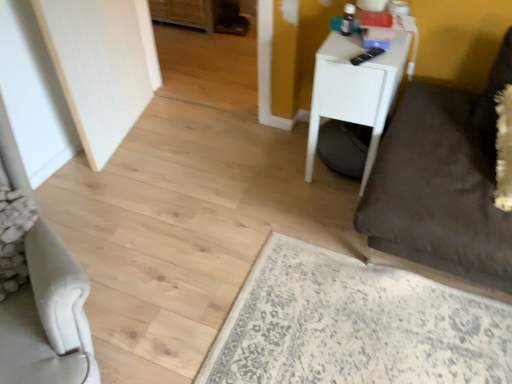
The image size is (512, 384). What do you see at coordinates (355, 90) in the screenshot? I see `white glossy table at upper right` at bounding box center [355, 90].

Image resolution: width=512 pixels, height=384 pixels. I want to click on white glossy table at upper right, so click(x=355, y=90).

This screenshot has height=384, width=512. I want to click on white glossy table at upper right, so click(355, 90).